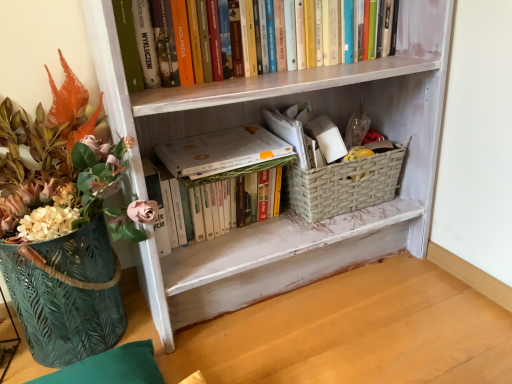
Question: Is woven beige basket at lower center taller or shorter than white matte book at center?

Choices:
 (A) short
 (B) tall

Answer: (B)

Question: From the image's perspective, is woven beige basket at lower center above or below white matte book at center?

Choices:
 (A) below
 (B) above

Answer: (A)

Question: Considering the real-world distances, which object is closest to the hardcover books at upper center, which ranks as the first book in top-to-bottom order?

Choices:
 (A) woven beige basket at lower center
 (B) white matte book at center
 (C) white matte book at center, which is the 1th book in bottom-to-top order
 (D) green textured basket at left
 (E) white painted wood bookcase at center

Answer: (B)

Question: Estimate the real-world distances between objects in this image. Which object is farther from the white matte book at center?

Choices:
 (A) green textured basket at left
 (B) hardcover books at upper center, which ranks as the first book in top-to-bottom order
 (C) white matte book at center, which is the 1th book in bottom-to-top order
 (D) woven beige basket at lower center
 (E) white painted wood bookcase at center

Answer: (A)